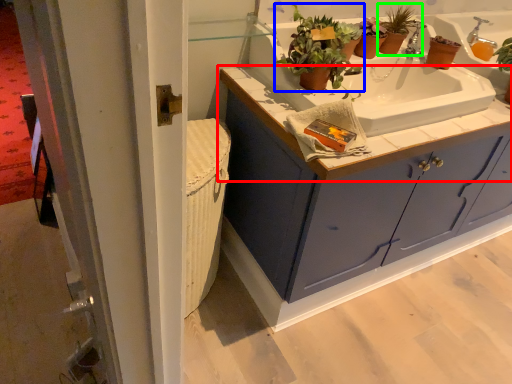
Question: Based on their relative distances, which object is farther from countertop (highlighted by a red box)? Choose from houseplant (highlighted by a blue box) and houseplant (highlighted by a green box).

Choices:
 (A) houseplant
 (B) houseplant

Answer: (B)